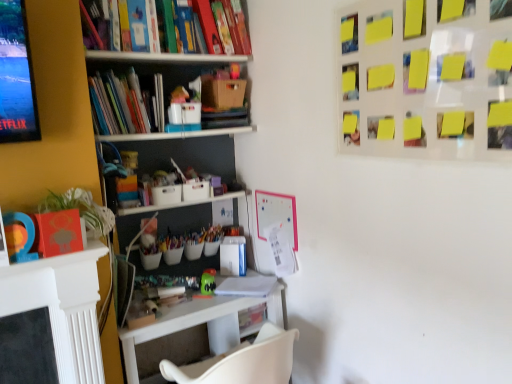
Image resolution: width=512 pixels, height=384 pixels. Describe the element at coordinates (126, 103) in the screenshot. I see `hardcover books at left` at that location.

Find the location of a particular element. The width and height of the screenshot is (512, 384). brown cardboard box at upper center is located at coordinates (223, 93).

Consider the image. What is the approximate width of yellow sticky notes at upper right?

yellow sticky notes at upper right is 2.74 inches wide.

What is the approximate height of white plastic table at lower left?

24.81 inches.

Measure the distance between white plastic table at lower left and camera.

1.96 meters.

Locate an element on the screen. hardcover books at left is located at coordinates (126, 103).

Which object is thinner, brown cardboard box at upper center or green leafy plant at left?

With smaller width is green leafy plant at left.

Measure the distance from brown cardboard box at upper center to green leafy plant at left.

brown cardboard box at upper center and green leafy plant at left are 36.37 inches apart from each other.

Which point is more distant from viewer, (216, 82) or (90, 200)?

The point (216, 82) is behind.

Who is shorter, brown cardboard box at upper center or green leafy plant at left?

brown cardboard box at upper center.

In order to click on cardboard box above the white plastic table at lower left (from a real-world perspective) in this screenshot , I will do `click(223, 93)`.

Considering the sizes of brown cardboard box at upper center and white plastic table at lower left in the image, is brown cardboard box at upper center taller or shorter than white plastic table at lower left?

brown cardboard box at upper center is shorter than white plastic table at lower left.

From a real-world perspective, is brown cardboard box at upper center below white plastic table at lower left?

No.

Is yellow sticky notes at upper right turned away from green matte toy at center?

No, yellow sticky notes at upper right is not facing away from green matte toy at center.

Are yellow sticky notes at upper right and green matte toy at center beside each other?

There is a gap between yellow sticky notes at upper right and green matte toy at center.

What's the angular difference between yellow sticky notes at upper right and green matte toy at center's facing directions?

They differ by 90 degrees in their facing directions.

Is yellow sticky notes at upper right bigger than green matte toy at center?

Yes.

You are a GUI agent. You are given a task and a screenshot of the screen. Output one action in this format:
    pyautogui.click(x=<x>, y=<y>)
    Task: Click on the plant in front of the white plastic table at lower left
    The image size is (512, 384).
    Given the screenshot: What is the action you would take?
    pyautogui.click(x=81, y=209)

Based on the photo, does white plastic table at lower left have a greater width compared to green leafy plant at left?

Correct, the width of white plastic table at lower left exceeds that of green leafy plant at left.

From the image's perspective, would you say white plastic table at lower left is shown under green leafy plant at left?

Correct, white plastic table at lower left appears lower than green leafy plant at left in the image.

Considering the relative sizes of white plastic table at lower left and green leafy plant at left in the image provided, is white plastic table at lower left bigger than green leafy plant at left?

Indeed, white plastic table at lower left has a larger size compared to green leafy plant at left.

How different are the orientations of green leafy plant at left and hardcover books at left in degrees?

0 degrees.

Does green leafy plant at left have a lesser width compared to hardcover books at left?

Yes, green leafy plant at left is thinner than hardcover books at left.

Are green leafy plant at left and hardcover books at left located far from each other?

That's not correct — green leafy plant at left is a little close to hardcover books at left.

I want to click on book above the green leafy plant at left (from the image's perspective), so click(126, 103).

From the image's perspective, is hardcover books at left on top of yellow sticky notes at upper right?

Correct, hardcover books at left appears higher than yellow sticky notes at upper right in the image.

Considering the relative sizes of hardcover books at left and yellow sticky notes at upper right in the image provided, is hardcover books at left bigger than yellow sticky notes at upper right?

Yes.

Between hardcover books at left and yellow sticky notes at upper right, which one is positioned behind?

hardcover books at left is further from the camera.

Are hardcover books at left and yellow sticky notes at upper right making contact?

No.

Is white plastic table at lower left to the left or to the right of yellow sticky notes at upper right in the image?

Clearly, white plastic table at lower left is on the left of yellow sticky notes at upper right in the image.

From a real-world perspective, which object stands above the other?

yellow sticky notes at upper right, from a real-world perspective.

Identify the location of bulletin board positioned vertically above the white plastic table at lower left (from a real-world perspective). This screenshot has width=512, height=384. (426, 80).

Identify the location of plant below the brown cardboard box at upper center (from the image's perspective). [81, 209].

Find the location of a particular element. The image size is (512, 384). cardboard box located behind the white plastic table at lower left is located at coordinates [223, 93].

Considering their positions, is yellow sticky notes at upper right positioned closer to green leafy plant at left than white plastic table at lower left?

Based on the image, white plastic table at lower left appears to be nearer to green leafy plant at left.

Consider the image. Estimate the real-world distances between objects in this image. Which object is closer to white plastic table at lower left, yellow sticky notes at upper right or brown cardboard box at upper center?

Based on the image, brown cardboard box at upper center appears to be nearer to white plastic table at lower left.

When comparing their distances from yellow sticky notes at upper right, does white plastic table at lower left or brown cardboard box at upper center seem further?

Among the two, white plastic table at lower left is located further to yellow sticky notes at upper right.

Considering their positions, is hardcover books at left positioned closer to green leafy plant at left than brown cardboard box at upper center?

hardcover books at left is closer to green leafy plant at left.

Based on the photo, from the image, which object appears to be nearer to green leafy plant at left, green matte toy at center or yellow sticky notes at upper right?

The object closer to green leafy plant at left is green matte toy at center.

From the image, which object appears to be nearer to yellow sticky notes at upper right, green leafy plant at left or white plastic table at lower left?

The object closer to yellow sticky notes at upper right is green leafy plant at left.

From the image, which object appears to be farther from green matte toy at center, hardcover books at left or yellow sticky notes at upper right?

yellow sticky notes at upper right is further to green matte toy at center.

When comparing their distances from green leafy plant at left, does hardcover books at left or green matte toy at center seem further?

Based on the image, green matte toy at center appears to be further to green leafy plant at left.

This screenshot has width=512, height=384. Identify the location of plant between yellow sticky notes at upper right and white plastic table at lower left in the up-down direction. (81, 209).

Where is `table between green leafy plant at left and green matte toy at center along the z-axis`? Image resolution: width=512 pixels, height=384 pixels. table between green leafy plant at left and green matte toy at center along the z-axis is located at coordinates (204, 322).

Where is `cardboard box located between yellow sticky notes at upper right and green matte toy at center in the depth direction`? This screenshot has height=384, width=512. cardboard box located between yellow sticky notes at upper right and green matte toy at center in the depth direction is located at coordinates (223, 93).

You are a GUI agent. You are given a task and a screenshot of the screen. Output one action in this format:
    pyautogui.click(x=<x>, y=<y>)
    Task: Click on the plant between brown cardboard box at upper center and green matte toy at center from top to bottom
    Image resolution: width=512 pixels, height=384 pixels.
    Given the screenshot: What is the action you would take?
    pyautogui.click(x=81, y=209)